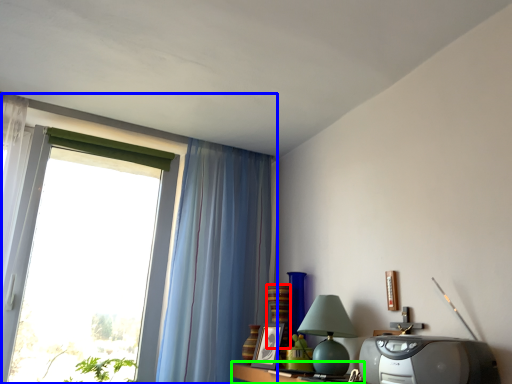
Question: Considering the real-world distances, which object is closest to vase (highlighted by a red box)? window (highlighted by a blue box) or table (highlighted by a green box).

Choices:
 (A) window
 (B) table

Answer: (B)